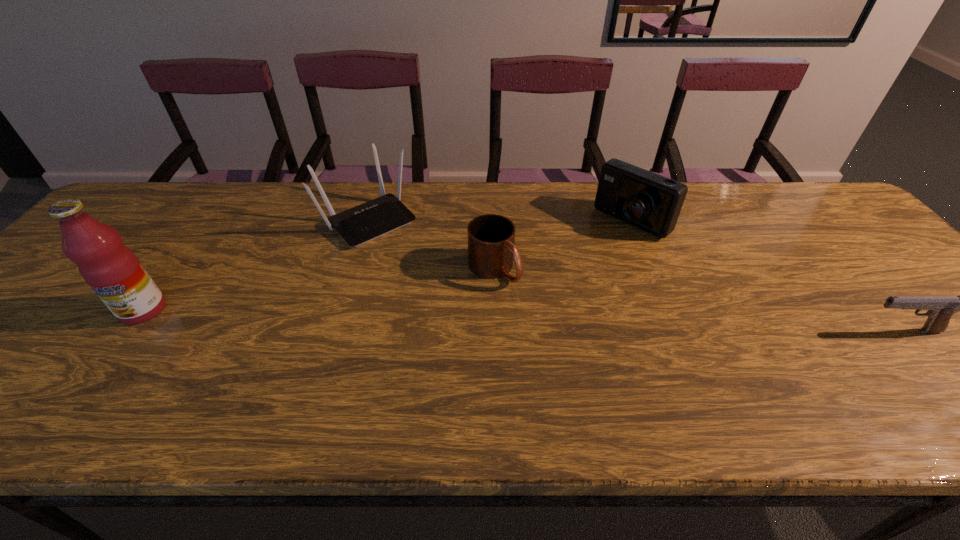
The width and height of the screenshot is (960, 540). In order to click on vacant point located between the nearest object and the third object from right to left in this screenshot , I will do [x=698, y=300].

Locate an element on the screen. free space between the router and the mug is located at coordinates (431, 244).

Locate an element on the screen. This screenshot has height=540, width=960. free space between the tallest object and the rightmost object is located at coordinates (522, 321).

Where is `vacant area that lies between the leftmost object and the nearest object`? The width and height of the screenshot is (960, 540). vacant area that lies between the leftmost object and the nearest object is located at coordinates (522, 321).

This screenshot has height=540, width=960. In order to click on vacant point located between the leftmost object and the third object from left to right in this screenshot , I will do `click(319, 289)`.

At what (x,y) coordinates should I click in order to perform the action: click on free space between the tallest object and the router. Please return your answer as a coordinate pair (x, y). Looking at the image, I should click on (256, 265).

Locate an element on the screen. vacant point located between the fourth object from right to left and the fourth farthest object is located at coordinates (256, 265).

Image resolution: width=960 pixels, height=540 pixels. I want to click on object that is the closest to the camera, so click(x=491, y=237).

Select which object is the second closest to the camera. Please provide its 2D coordinates. Your answer should be formatted as a tuple, i.e. [(x, y)], where the tuple contains the x and y coordinates of a point satisfying the conditions above.

[(940, 309)]